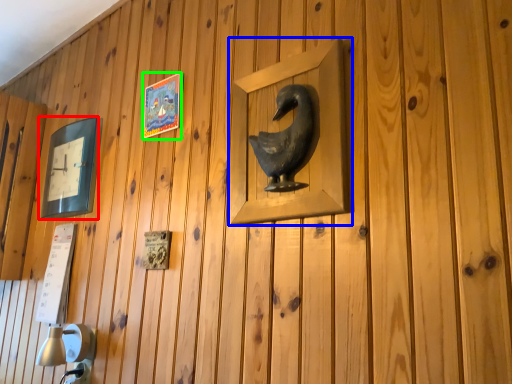
Question: Estimate the real-world distances between objects in this image. Which object is closer to picture frame (highlighted by a red box), picture frame (highlighted by a blue box) or picture frame (highlighted by a green box)?

Choices:
 (A) picture frame
 (B) picture frame

Answer: (B)